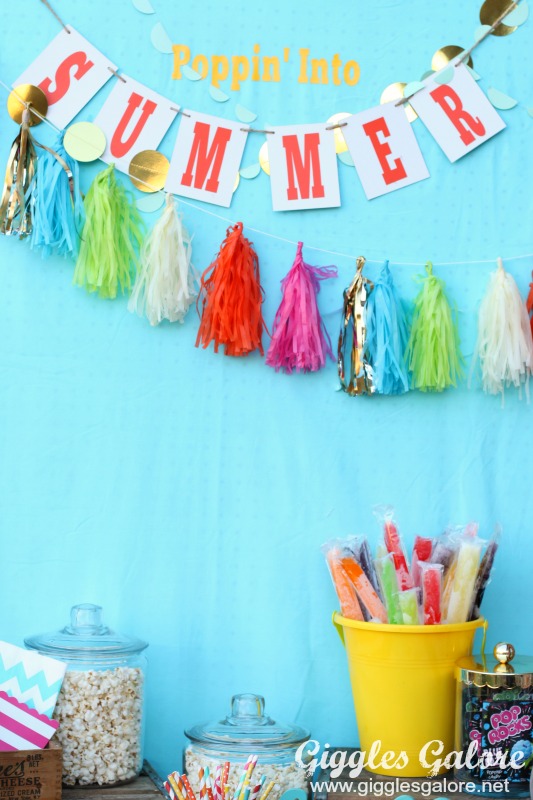
Where is `glass containers`? The width and height of the screenshot is (533, 800). glass containers is located at coordinates (504, 724), (268, 761), (111, 670).